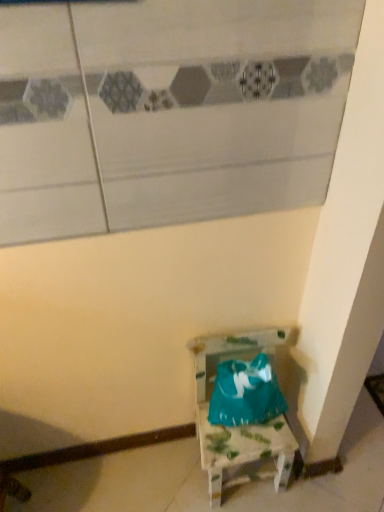
Where is `vacant space situated on the left part of wooden painted chair at lower right`? This screenshot has height=512, width=384. vacant space situated on the left part of wooden painted chair at lower right is located at coordinates (160, 472).